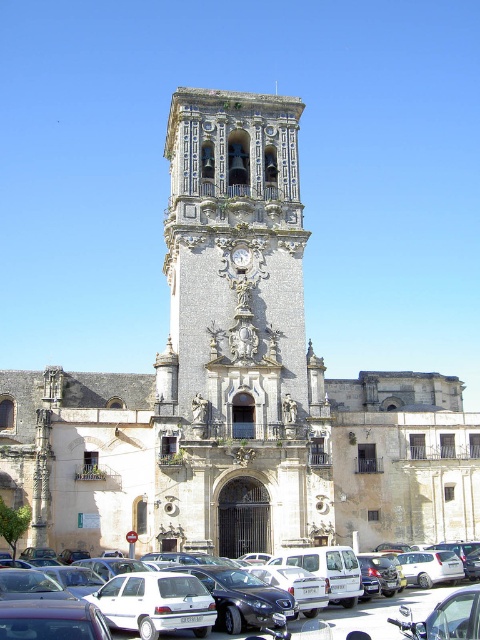
Question: Does beige stone church at center have a smaller size compared to white matte cars at lower center?

Choices:
 (A) yes
 (B) no

Answer: (B)

Question: Which of the following is the closest to the observer?

Choices:
 (A) gold textured clock at center
 (B) white matte cars at lower center
 (C) stone ornate tower at center
 (D) beige stone church at center

Answer: (B)

Question: Is beige stone church at center positioned at the back of white matte cars at lower center?

Choices:
 (A) yes
 (B) no

Answer: (A)

Question: Which point is farther from the camera taking this photo?

Choices:
 (A) (380, 598)
 (B) (180, 145)
 (C) (238, 317)

Answer: (B)

Question: Is beige stone church at center below gold textured clock at center?

Choices:
 (A) yes
 (B) no

Answer: (A)

Question: Based on their relative distances, which object is farther from the stone ornate tower at center?

Choices:
 (A) beige stone church at center
 (B) gold textured clock at center

Answer: (B)